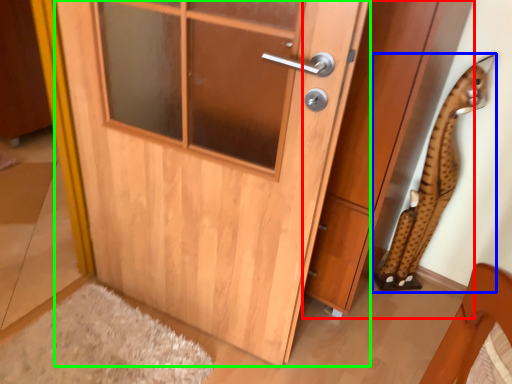
Question: Which object is the closest to the cabinetry (highlighted by a red box)? Choose among these: animal (highlighted by a blue box) or door (highlighted by a green box).

Choices:
 (A) animal
 (B) door

Answer: (A)